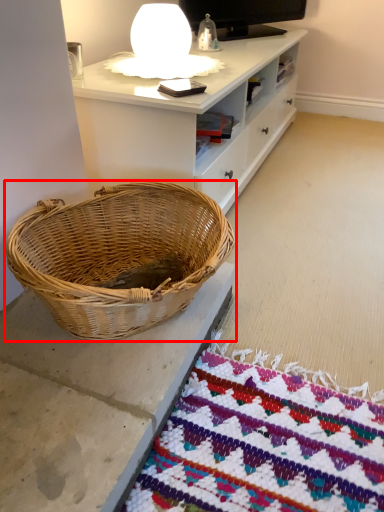
Question: From the image, what is the correct spatial relationship of picnic basket (annotated by the red box) in relation to table lamp?

Choices:
 (A) left
 (B) right

Answer: (A)